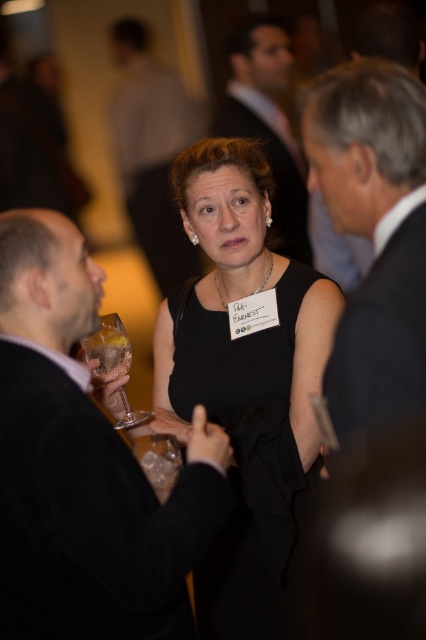
You are a photographer at a formal event. You notice two men wearing black suits in the image. The man in the black matte suit at left is standing closer to the camera than the man in the black suit at upper right. Can you determine which man appears taller in the photo?

The black matte suit at left is larger in size than the black suit at upper right, so the man in the black matte suit at left appears taller in the photo.